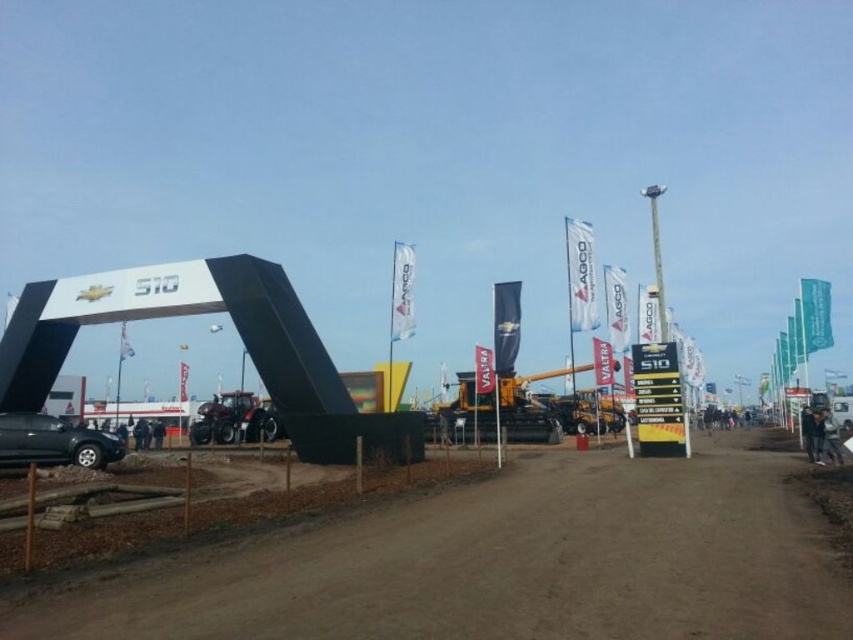
Measure the distance between brown dirt track at center and matte black suv at lower left.

A distance of 31.76 feet exists between brown dirt track at center and matte black suv at lower left.

Measure the distance between point (x=749, y=538) and camera.

Point (x=749, y=538) is 6.16 meters away from camera.

Locate an element on the screen. The height and width of the screenshot is (640, 853). brown dirt track at center is located at coordinates (502, 563).

Can you confirm if matte black suv at lower left is thinner than metallic red tractor at center?

Correct, matte black suv at lower left's width is less than metallic red tractor at center's.

Measure the distance from matte black suv at lower left to metallic red tractor at center.

matte black suv at lower left is 13.13 meters from metallic red tractor at center.

Is point (13, 413) positioned behind point (206, 424)?

That is False.

The image size is (853, 640). In order to click on matte black suv at lower left in this screenshot , I will do `click(53, 442)`.

Is brown dirt track at center below metallic red tractor at center?

Incorrect, brown dirt track at center is not positioned below metallic red tractor at center.

Who is positioned more to the right, brown dirt track at center or metallic red tractor at center?

brown dirt track at center

Locate an element on the screen. brown dirt track at center is located at coordinates (502, 563).